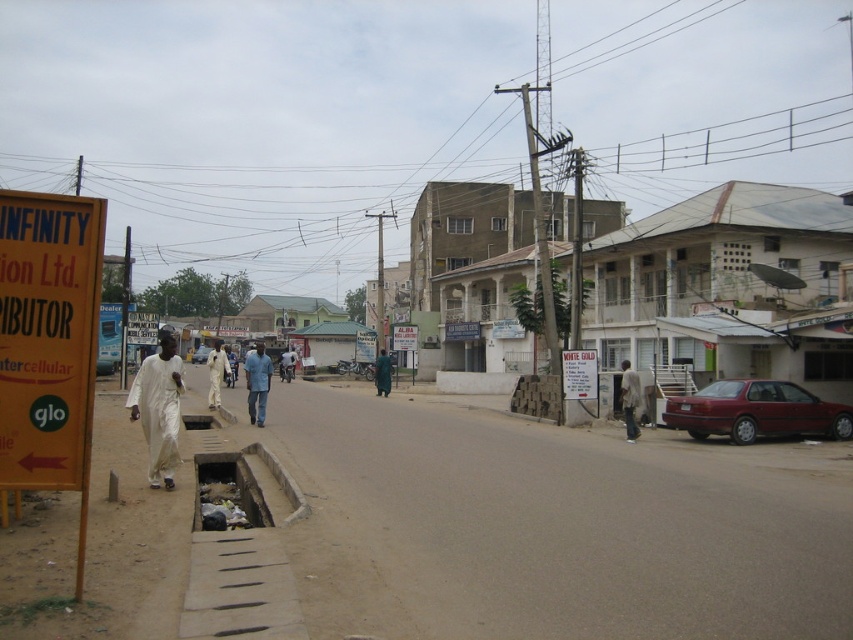
Can you confirm if white matte clothing at left is bigger than white cardboard sign at center?

Yes, white matte clothing at left is bigger than white cardboard sign at center.

Measure the distance between point (172, 428) and camera.

Point (172, 428) is 10.11 meters from camera.

Does point (170, 368) come farther from viewer compared to point (577, 374)?

No, it is in front of (577, 374).

You are a GUI agent. You are given a task and a screenshot of the screen. Output one action in this format:
    pyautogui.click(x=<x>, y=<y>)
    Task: Click on the white matte clothing at left
    
    Given the screenshot: What is the action you would take?
    pyautogui.click(x=158, y=410)

Is matte red car at right taller than green fabric person at center?

No, matte red car at right is not taller than green fabric person at center.

Which of these two, matte red car at right or green fabric person at center, stands taller?

green fabric person at center

The height and width of the screenshot is (640, 853). In order to click on matte red car at right in this screenshot , I will do `click(756, 412)`.

At what (x,y) coordinates should I click in order to perform the action: click on matte red car at right. Please return your answer as a coordinate pair (x, y). Looking at the image, I should click on (756, 412).

Which of these two, blue fabric shirt at center or metallic silver car at center, stands taller?

blue fabric shirt at center is taller.

In order to click on blue fabric shirt at center in this screenshot , I will do `click(257, 381)`.

Where is `blue fabric shirt at center`? blue fabric shirt at center is located at coordinates (257, 381).